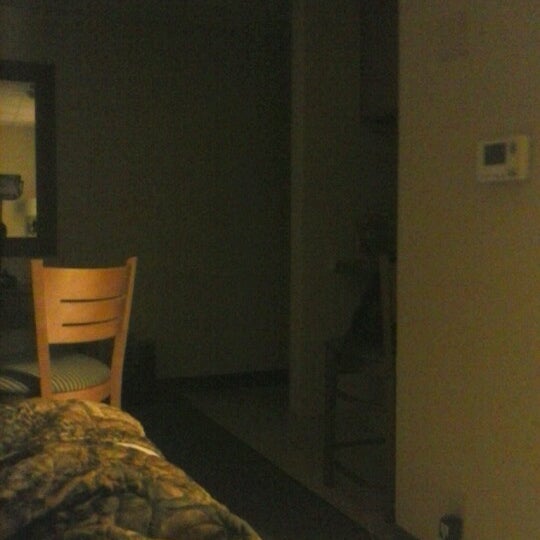
Find the location of a particular element. The image size is (540, 540). possible wall outlet is located at coordinates (448, 521).